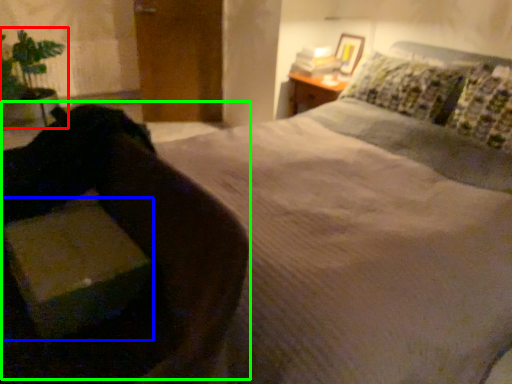
Question: Based on their relative distances, which object is farther from houseplant (highlighted by a red box)? Choose from cardboard box (highlighted by a blue box) and swivel chair (highlighted by a green box).

Choices:
 (A) cardboard box
 (B) swivel chair

Answer: (A)